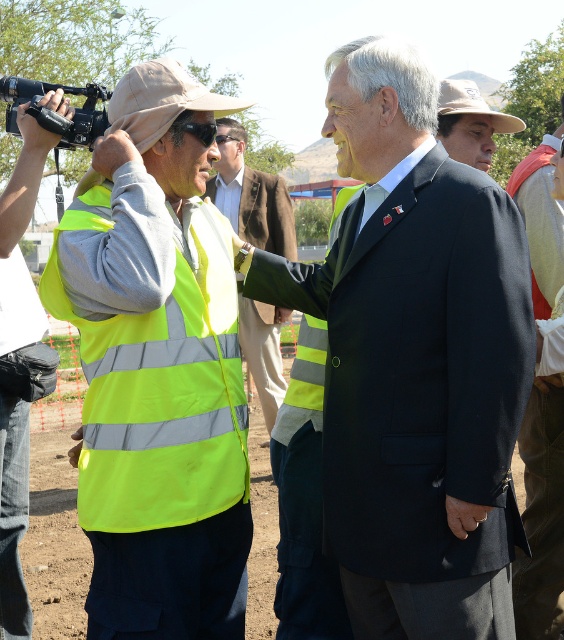
Looking at this image, you are a photographer at the construction site. You need to take a photo of both the black suit at center and the khaki fabric hat at center. Based on their positions, which object should be in focus first to ensure both are visible clearly?

The black suit at center is in front of the khaki fabric hat at center, so to ensure both are visible clearly, focus on the black suit at center first.

You are a safety inspector at the construction site. You need to ensure that all safety gear is properly worn. Looking at the reflective yellow vest at center and the khaki fabric hat at center, which one is positioned higher on the person?

The reflective yellow vest at center is taller than the khaki fabric hat at center, so the vest is positioned higher on the person.

You are a photographer at the construction site. You need to capture a photo that includes both the black suit at center and the khaki fabric hat at center. Given their sizes, which object should you ensure is framed closer to the camera to maintain their relative sizes in the photo?

The black suit at center is larger in size compared to the khaki fabric hat at center. To maintain their relative sizes in the photo, you should frame the khaki fabric hat at center closer to the camera since it is smaller and needs to appear proportionally smaller than the black suit at center.